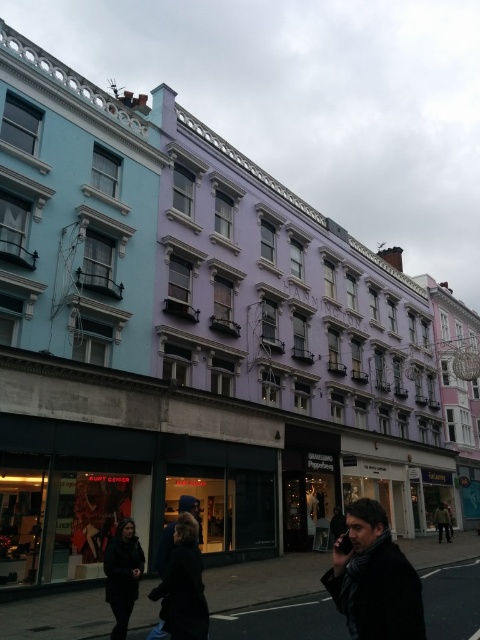
You are a delivery person standing at the entrance of the Kurt Geiger shop. You need to place a dark blue jacket at lower center and a dark gray scarf at center. Given that your delivery cart can only move 30 meters before needing to recharge, will you need to recharge between placing these items?

The distance between the dark blue jacket at lower center and the dark gray scarf at center is 35.83 meters. Since your delivery cart can only move 30 meters before recharging, you will need to recharge between placing these items.

You are a customer looking for a scarf in a shop window. You see two dark gray scarves displayed in the window. One is labeled as a dark gray wool scarf at lower right and the other is a dark gray scarf at center. Which scarf is displayed higher up in the window?

The dark gray wool scarf at lower right is displayed higher up in the window as it is positioned above the dark gray scarf at center.